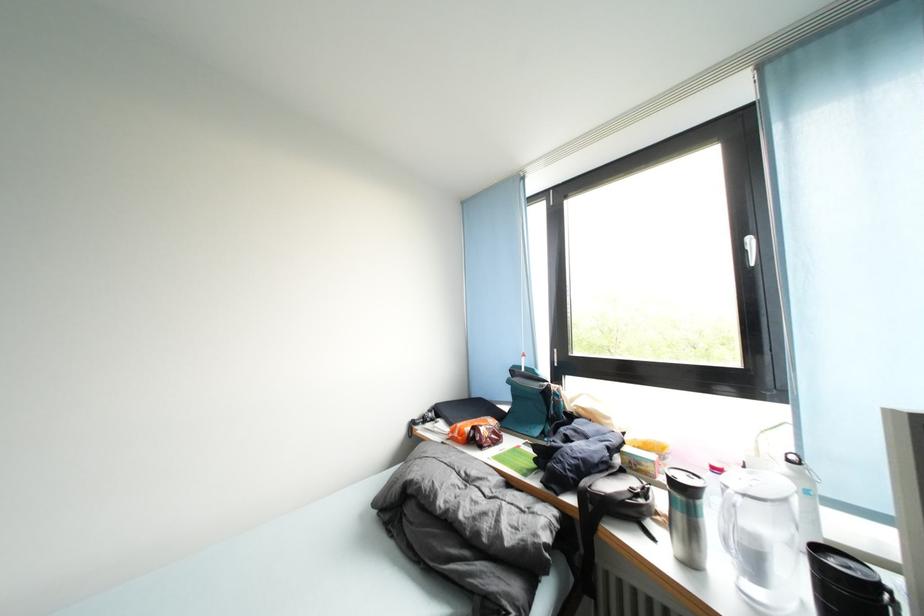
Image resolution: width=924 pixels, height=616 pixels. Describe the element at coordinates (749, 249) in the screenshot. I see `the white window handle` at that location.